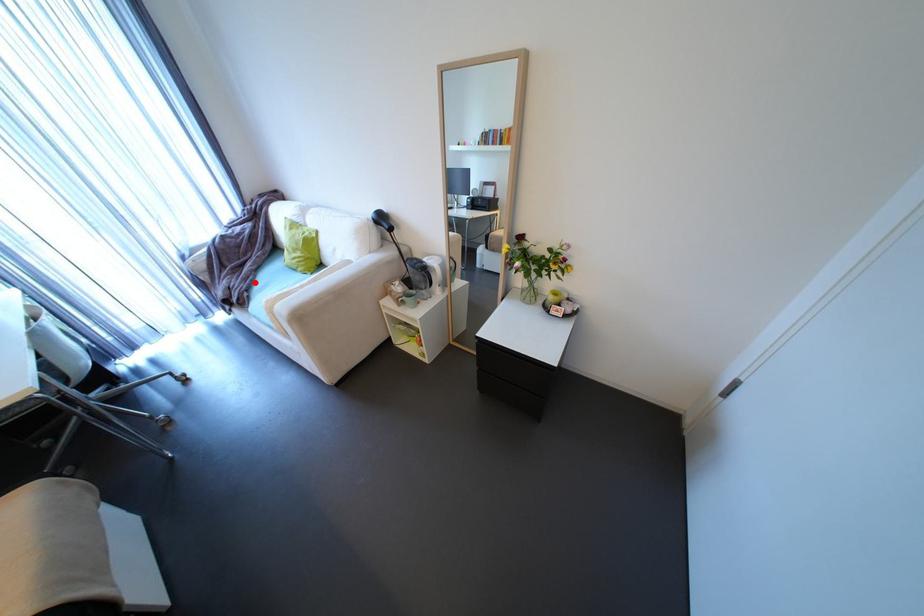
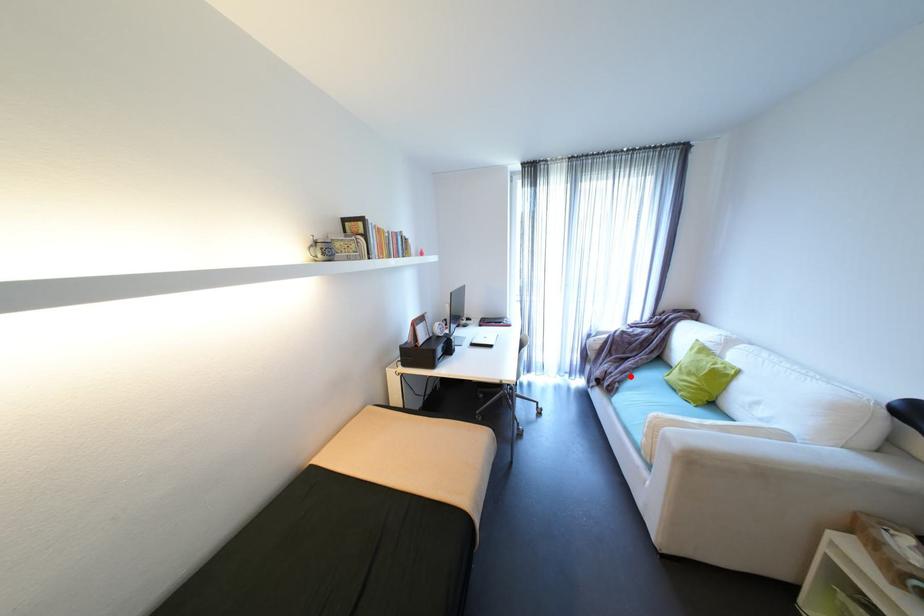
From the picture: I am providing you with two images of the same scene from different viewpoints. A red point is marked on the first image and another point is marked on the second image. Is the red point in image1 aligned with the point shown in image2?

Yes